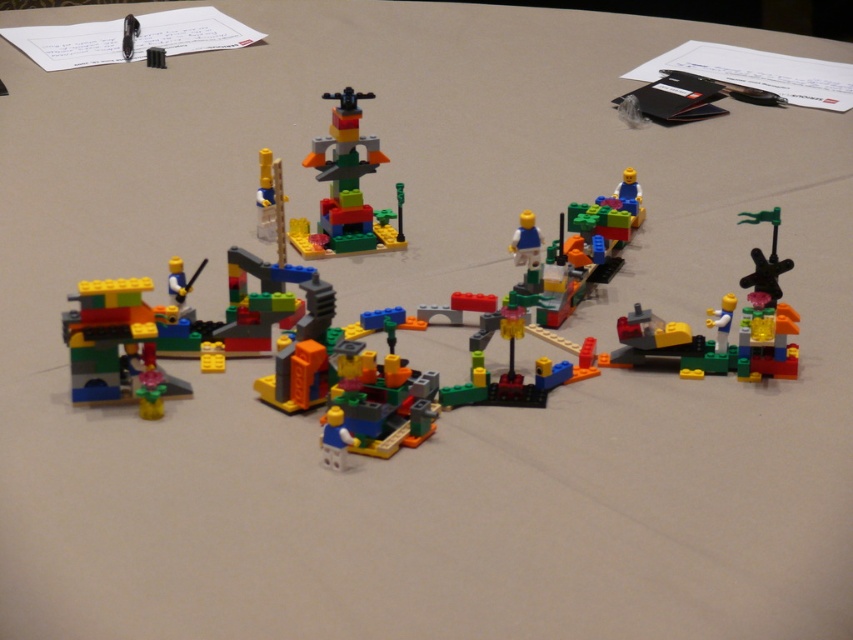
Question: Observing the image, what is the correct spatial positioning of multicolored plastic tower at center in reference to translucent green plastic spinner at right?

Choices:
 (A) left
 (B) right

Answer: (A)

Question: Which object is farther from the camera taking this photo?

Choices:
 (A) translucent green plastic spinner at right
 (B) multicolored plastic tower at center

Answer: (B)

Question: Among these objects, which one is nearest to the camera?

Choices:
 (A) multicolored plastic tower at center
 (B) translucent green plastic spinner at right

Answer: (B)

Question: Which object appears closest to the camera in this image?

Choices:
 (A) multicolored plastic tower at center
 (B) translucent green plastic spinner at right

Answer: (B)

Question: Is the position of multicolored plastic tower at center more distant than that of translucent green plastic spinner at right?

Choices:
 (A) yes
 (B) no

Answer: (A)

Question: Where is multicolored plastic tower at center located in relation to translucent green plastic spinner at right in the image?

Choices:
 (A) left
 (B) right

Answer: (A)